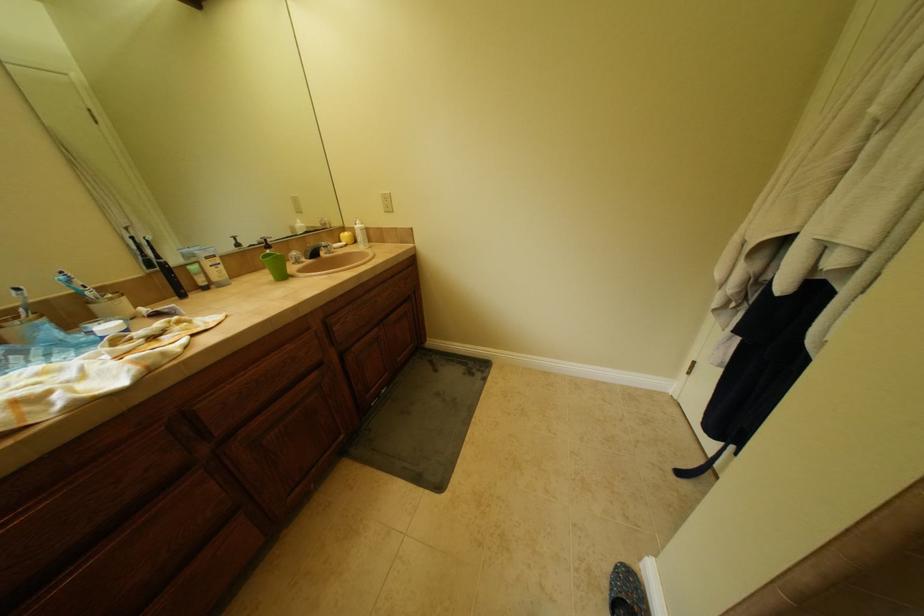
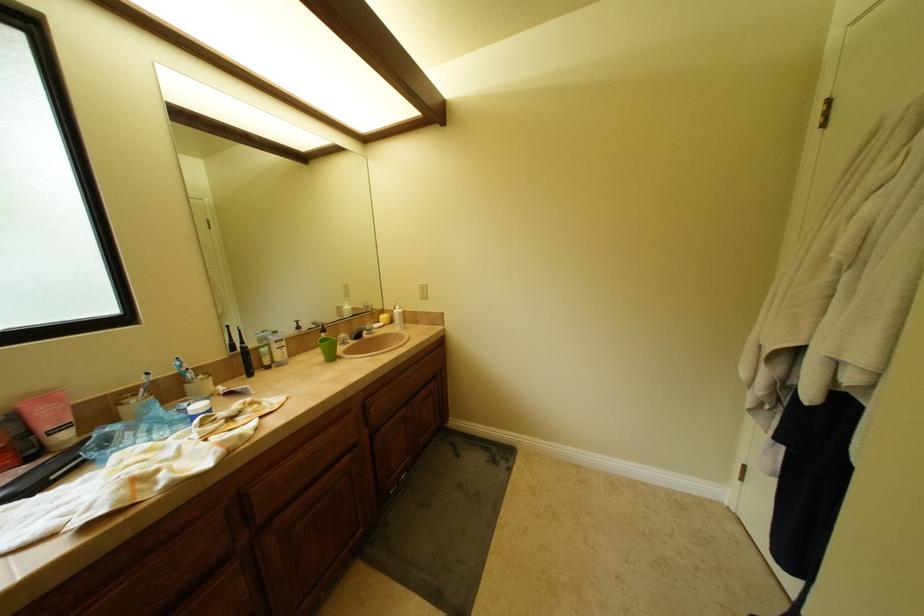
What movement of the cameraman would produce the second image?

The cameraman walked toward left, backward.